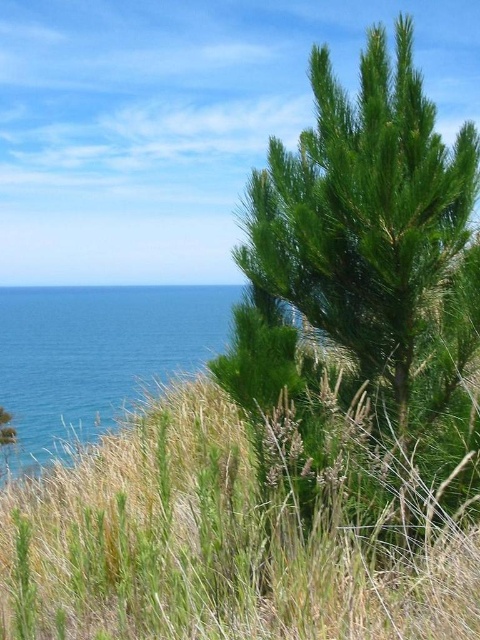
You are a hiker who wants to cross the area where the green grassy at center and blue liquid water at left are located. Which one is shorter so you can step over easily?

The green grassy at center has a lesser height compared to blue liquid water at left, so you can step over the green grassy at center easily.